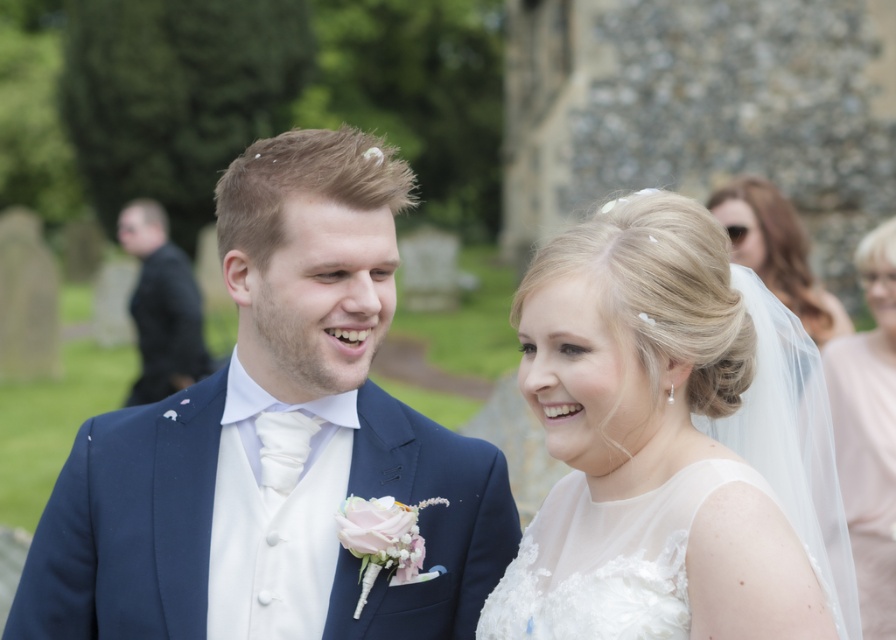
You are a photographer positioned between the translucent white veil at right and the black suit at left. You need to move to the closest object to adjust lighting. Which object should you move towards?

The translucent white veil at right is 34.40 meters away from the black suit at left. Since you are positioned between them, moving towards the closer object depends on your exact location. However, without specific distances from you to each, it is impossible to determine which is nearer. Please clarify your position relative to both objects.

You are a photographer at a wedding and need to capture a photo of the white lace dress at center and the black suit at left. Based on their positions, which one is closer to the camera?

The white lace dress at center is closer to the camera because it is in front of the black suit at left.

You are a photographer at a wedding and need to position the couple so that the white lace dress at center is to the right of the black suit at left. Are they currently positioned correctly according to the scene?

Yes, the white lace dress at center is positioned on the right side of the black suit at left, so they are correctly positioned.